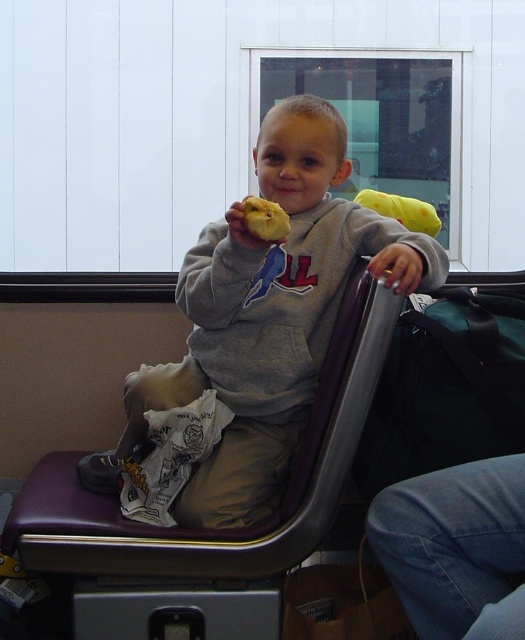
You are a photographer standing at a certain distance from the purple leather chair at center. You want to take a photo of the child sitting on the chair without including any background elements. Given that your camera has a focal length of 50mm and the chair is 4.52 feet away, what is the minimum distance you should move forward or backward to ensure the background is out of focus?

The purple leather chair at center is 4.52 feet from the camera. To ensure the background is out of focus, you should move closer to the chair so that the distance between the camera and the chair is less than 4.52 feet. This will help blur the background effectively.

You are a photographer who wants to capture the gray fleece sweatshirt at center and the yellow crumbly pastry at center in the same frame. Based on their positions, which object should you focus on to ensure both are in focus?

Since the gray fleece sweatshirt at center is to the left of the yellow crumbly pastry at center, you should focus on the gray fleece sweatshirt at center as it is closer to the camera, ensuring both objects remain in focus.

You are a photographer trying to capture the child in the image. Since the gray fleece sweatshirt at center and the purple leather chair at center are both in the frame, which object is positioned higher relative to the other?

The gray fleece sweatshirt at center is located above the purple leather chair at center, so the gray fleece sweatshirt at center is positioned higher.